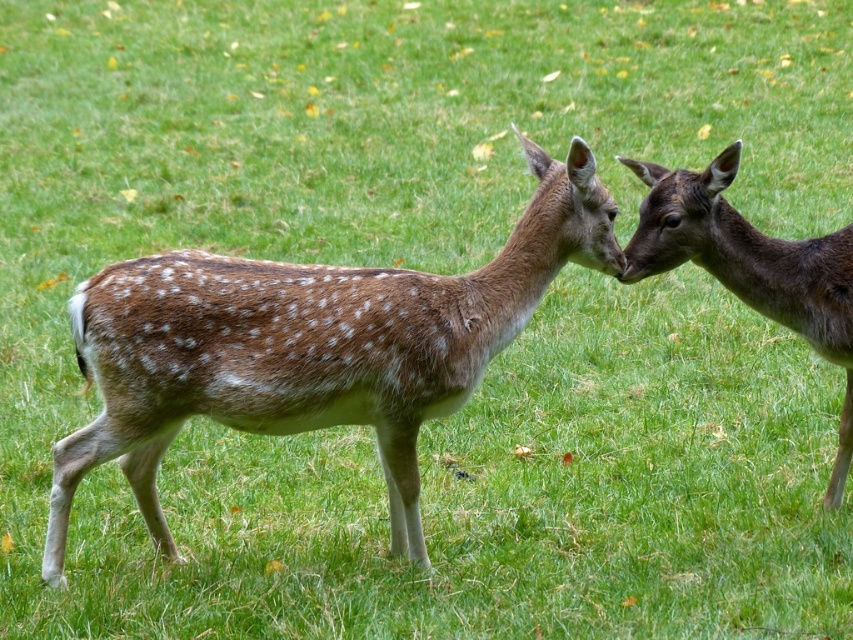
Question: Considering the relative positions of brown speckled fur at center and brown speckled fur at right in the image provided, where is brown speckled fur at center located with respect to brown speckled fur at right?

Choices:
 (A) left
 (B) right

Answer: (A)

Question: Does brown speckled fur at center come in front of brown speckled fur at right?

Choices:
 (A) no
 (B) yes

Answer: (A)

Question: Does brown speckled fur at center appear over brown speckled fur at right?

Choices:
 (A) yes
 (B) no

Answer: (B)

Question: Which object appears closest to the camera in this image?

Choices:
 (A) brown speckled fur at center
 (B) brown speckled fur at right

Answer: (B)

Question: Which object appears farthest from the camera in this image?

Choices:
 (A) brown speckled fur at center
 (B) brown speckled fur at right

Answer: (A)

Question: Which point appears farthest from the camera in this image?

Choices:
 (A) (795, 300)
 (B) (119, 296)

Answer: (A)